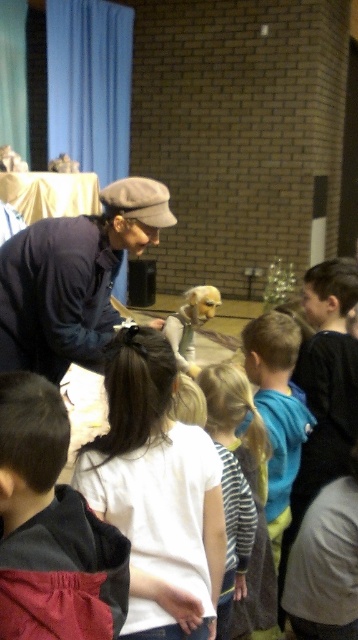
Question: Which point is farther to the camera?

Choices:
 (A) silvery metallic dog at center
 (B) striped shirt at center

Answer: (A)

Question: In this image, where is striped shirt at center located relative to silvery metallic dog at center?

Choices:
 (A) below
 (B) above

Answer: (A)

Question: Considering the real-world distances, which object is closest to the matte blue shirt at center?

Choices:
 (A) white cotton shirt at center
 (B) silvery metallic dog at center

Answer: (A)

Question: Is white cotton shirt at center thinner than matte blue shirt at center?

Choices:
 (A) no
 (B) yes

Answer: (B)

Question: Which point is farther to the camera?

Choices:
 (A) (205, 310)
 (B) (49, 342)
 (C) (207, 413)

Answer: (A)

Question: Can you confirm if striped shirt at center is bigger than silvery metallic dog at center?

Choices:
 (A) yes
 (B) no

Answer: (B)